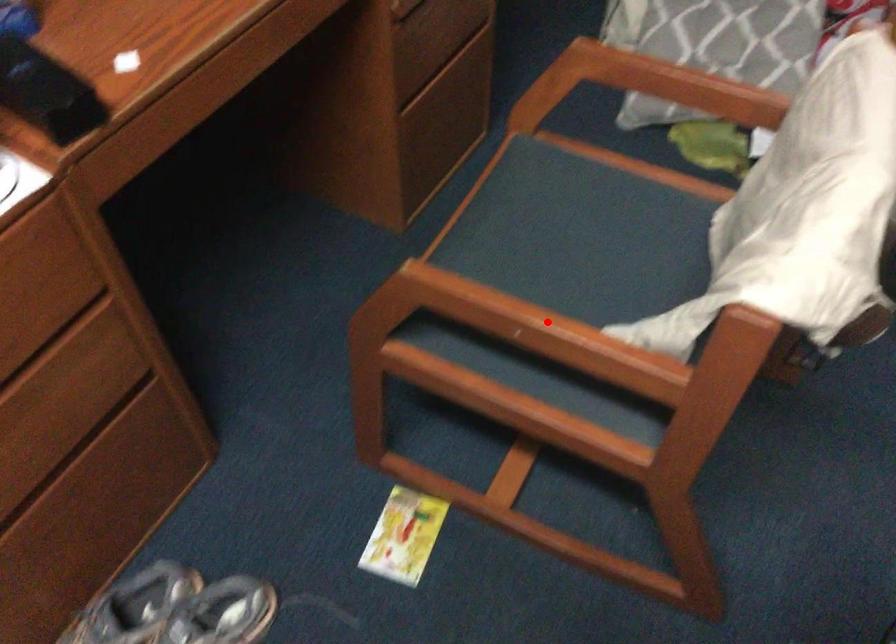
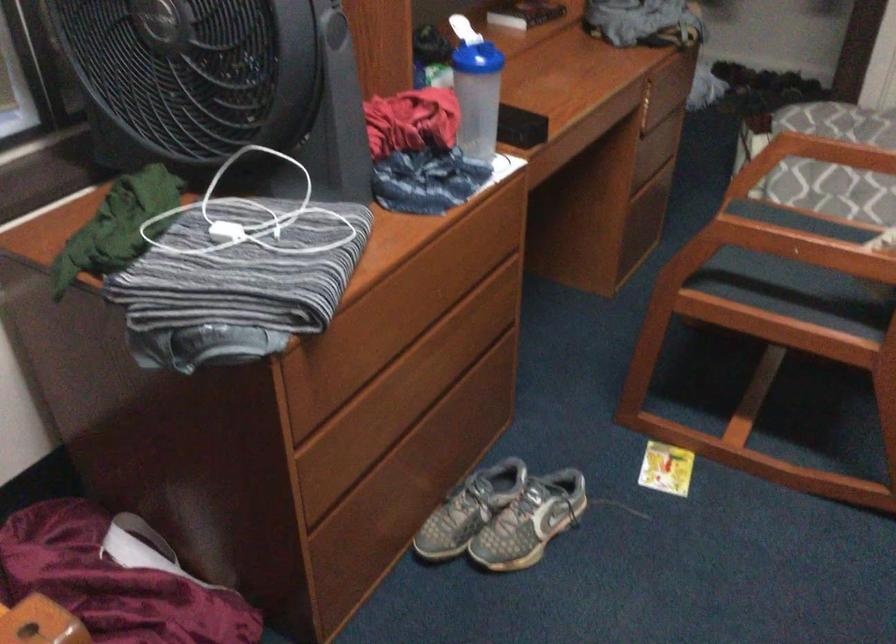
Question: I am providing you with two images of the same scene from different viewpoints. A red point is shown in image1. For the corresponding object point in image2, is it positioned nearer or farther from the camera?

Choices:
 (A) Nearer
 (B) Farther

Answer: (B)